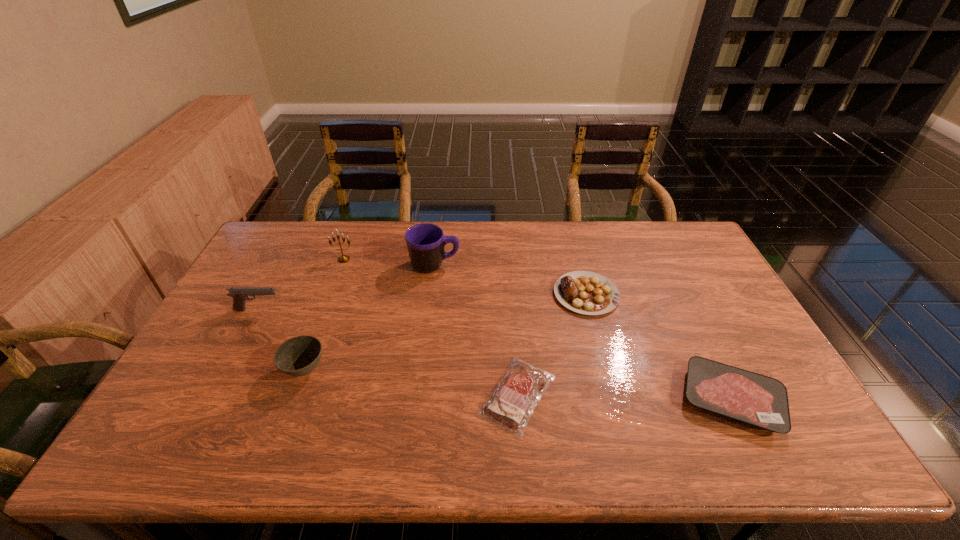
Find the location of a particular element. The image size is (960, 540). the fifth object from left to right is located at coordinates pyautogui.click(x=510, y=406).

Find the location of `free region located with the handle on the side of the fourth object from left to right`. free region located with the handle on the side of the fourth object from left to right is located at coordinates (554, 265).

Locate an element on the screen. This screenshot has height=540, width=960. vacant region located on the front of the candelabrum is located at coordinates (329, 297).

You are a GUI agent. You are given a task and a screenshot of the screen. Output one action in this format:
    pyautogui.click(x=<x>, y=<y>)
    Task: Click on the free location located at the barrel of the leftmost object
    
    Given the screenshot: What is the action you would take?
    pyautogui.click(x=364, y=310)

This screenshot has height=540, width=960. I want to click on vacant space situated on the front of the fourth tallest object, so click(279, 440).

Where is `vacant space positioned 0.400m on the left of the third shortest object`? vacant space positioned 0.400m on the left of the third shortest object is located at coordinates (427, 294).

This screenshot has height=540, width=960. I want to click on free spot located 0.230m on the left of the rightmost object, so click(588, 399).

Where is `vacant space located 0.390m on the left of the shortest steak`? This screenshot has width=960, height=540. vacant space located 0.390m on the left of the shortest steak is located at coordinates (322, 395).

Identify the location of mug that is at the far edge. (425, 242).

Image resolution: width=960 pixels, height=540 pixels. In order to click on candelabrum located at the far edge in this screenshot , I will do `click(344, 258)`.